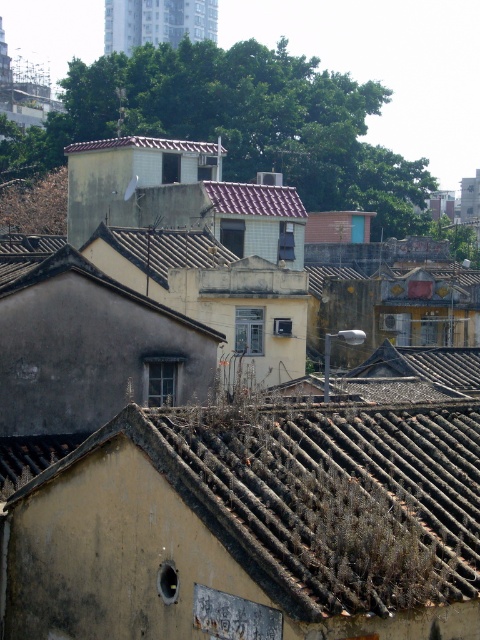
You are a window washer standing on the ground floor. You need to clean both the brown textured tile roof at lower center and the brown tile roof at upper center. Which roof should you tackle first if you want to start with the one that requires less ladder height?

The brown textured tile roof at lower center is shorter than the brown tile roof at upper center, so you should clean the brown textured tile roof at lower center first as it requires a shorter ladder height.

Consider the image. You are an architect analyzing the urban layout. You observe the brown textured tile roof at lower center and the brown tile roof at upper center. Which roof is positioned higher in the image?

The brown tile roof at upper center is positioned higher than the brown textured tile roof at lower center.

Consider the image. You are standing in the urban area depicted in the image. There is a point labeled as point (262, 515). Can you tell me what object or feature in the scene corresponds to this coordinate?

The point (262, 515) corresponds to the brown textured tile roof at lower center.